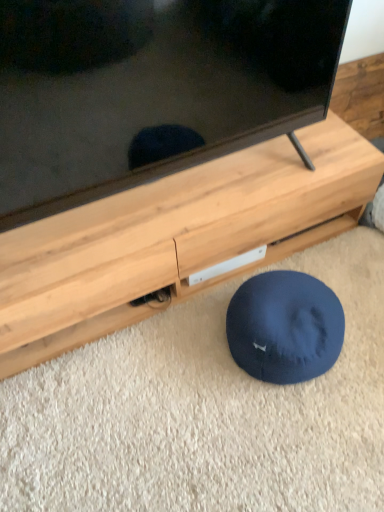
Question: Considering the positions of point (110, 78) and point (165, 183), is point (110, 78) closer or farther from the camera than point (165, 183)?

Choices:
 (A) closer
 (B) farther

Answer: (A)

Question: From a real-world perspective, is black glossy tv at upper center above or below wooden tv stand at center?

Choices:
 (A) above
 (B) below

Answer: (A)

Question: Estimate the real-world distances between objects in this image. Which object is farther from the wooden tv stand at center?

Choices:
 (A) navy blue fabric dog bed at lower center
 (B) black glossy tv at upper center

Answer: (A)

Question: Based on their relative distances, which object is farther from the navy blue fabric dog bed at lower center?

Choices:
 (A) wooden tv stand at center
 (B) black glossy tv at upper center

Answer: (B)